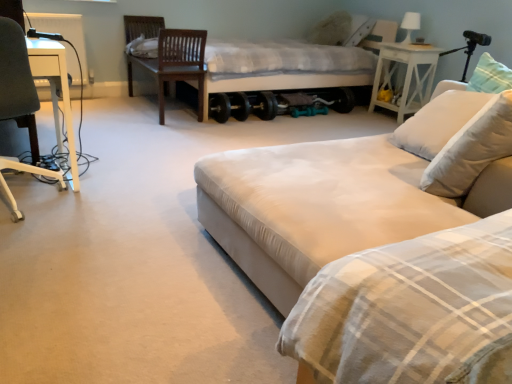
Identify the location of free space to the back side of white plastic chair at left. (103, 165).